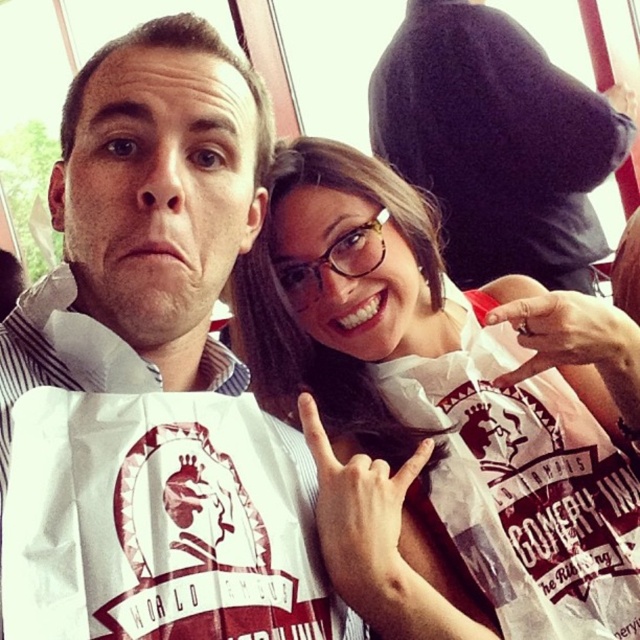
Does point (520, 522) come behind point (536, 161)?

No, (520, 522) is in front of (536, 161).

Who is positioned more to the right, white paper bag at center or matte black shirt at upper center?

matte black shirt at upper center

What do you see at coordinates (444, 412) in the screenshot?
I see `white paper bag at center` at bounding box center [444, 412].

Find the location of `white paper bag at center`. white paper bag at center is located at coordinates (444, 412).